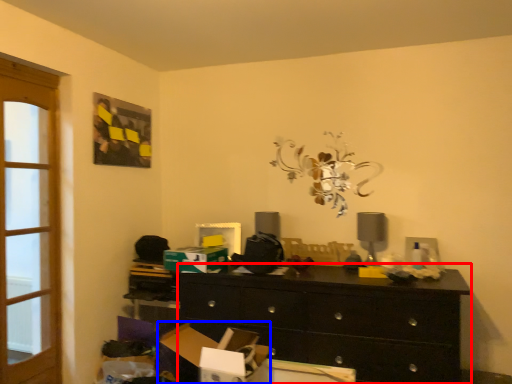
Question: Which object appears closest to the camera in this image, chest of drawers (highlighted by a red box) or cardboard box (highlighted by a blue box)?

Choices:
 (A) chest of drawers
 (B) cardboard box

Answer: (B)